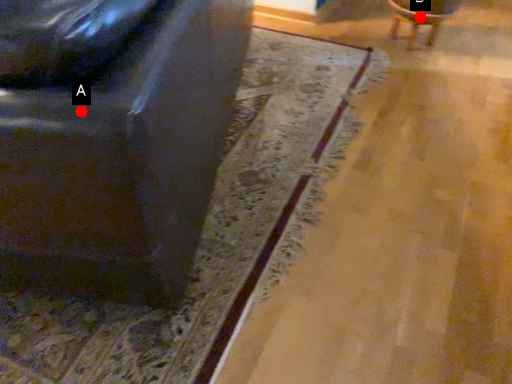
Question: Two points are circled on the image, labeled by A and B beside each circle. Which of the following is the closest to the observer?

Choices:
 (A) A is closer
 (B) B is closer

Answer: (A)